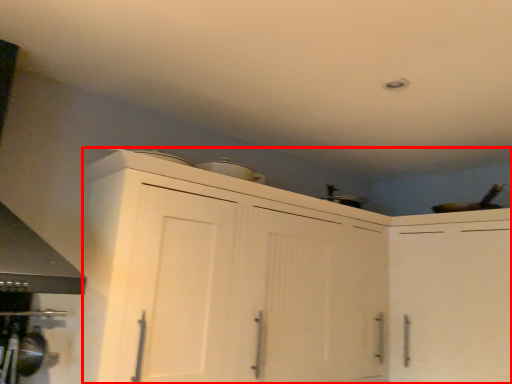
Question: From the image, what is the correct spatial relationship of cabinetry (annotated by the red box) in relation to cabinetry?

Choices:
 (A) right
 (B) left

Answer: (B)